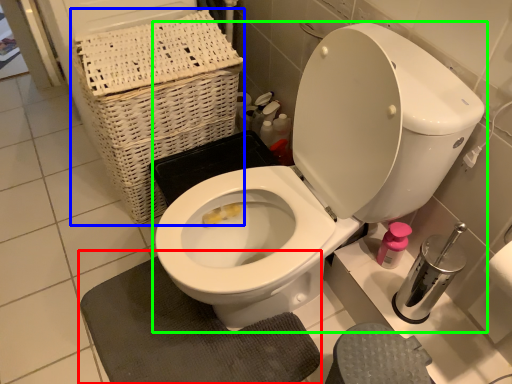
Question: Which object is positioned closest to bath mat (highlighted by a red box)? Select from basket (highlighted by a blue box) and toilet (highlighted by a green box).

Choices:
 (A) basket
 (B) toilet

Answer: (B)